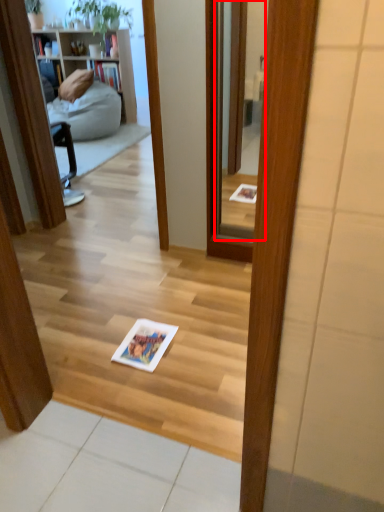
Question: From the image's perspective, where is mirror (annotated by the red box) located in relation to book in the image?

Choices:
 (A) below
 (B) above

Answer: (B)